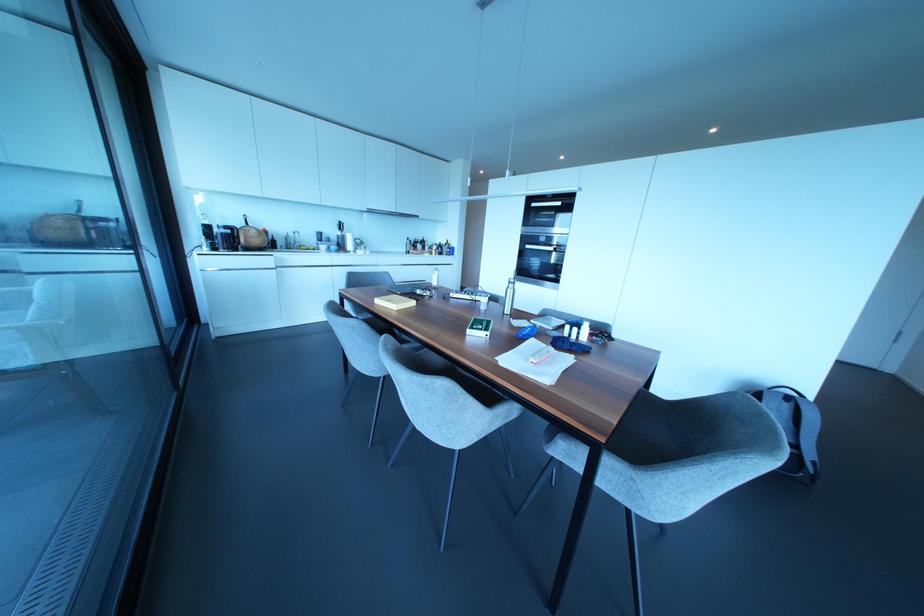
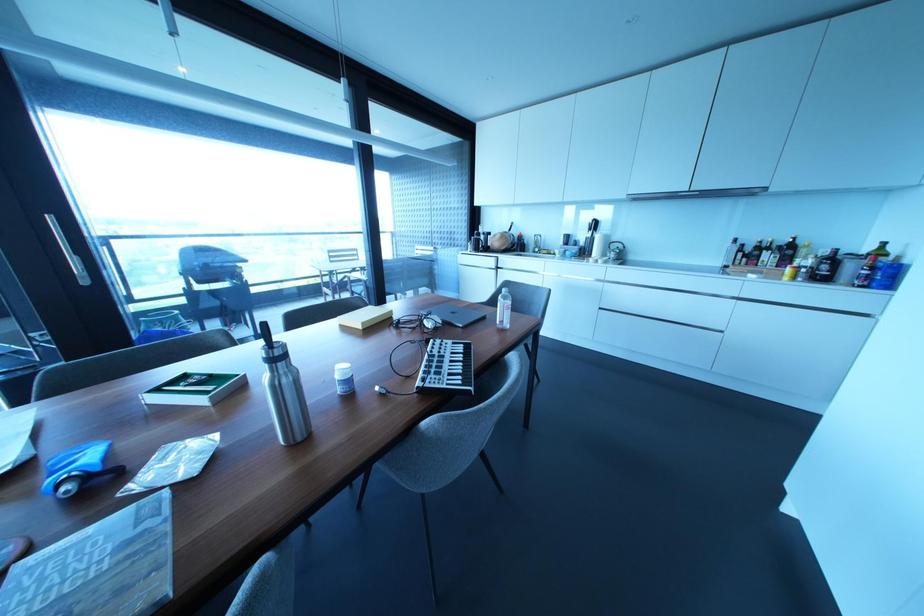
Find the pixel in the second image that matches (439,246) in the first image.

(833, 257)